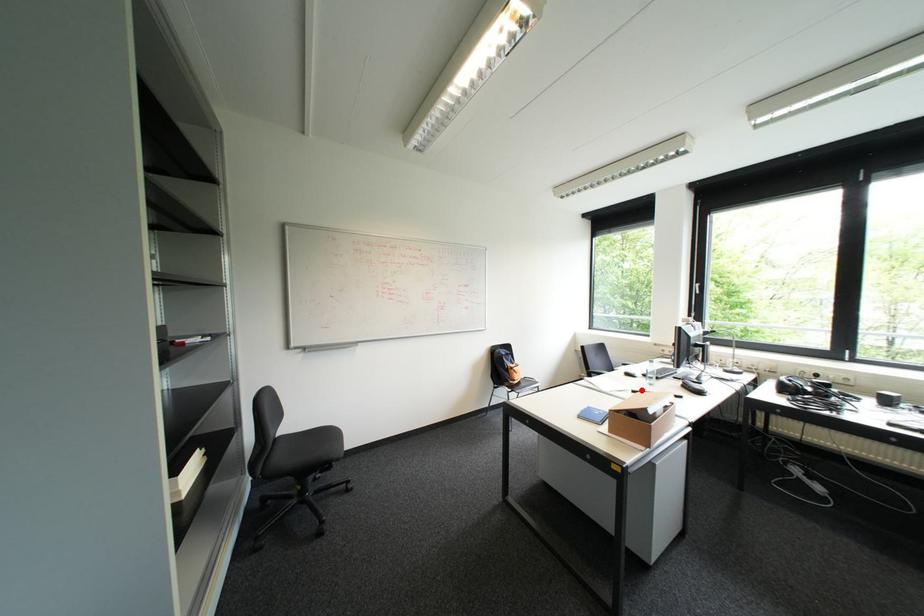
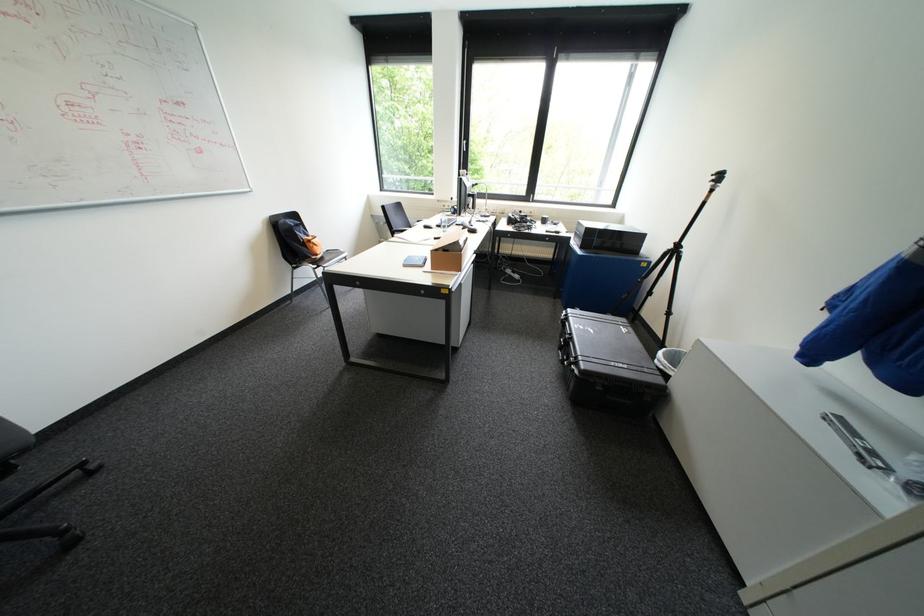
Find the pixel in the second image that matches the highlighted location in the first image.

(444, 237)